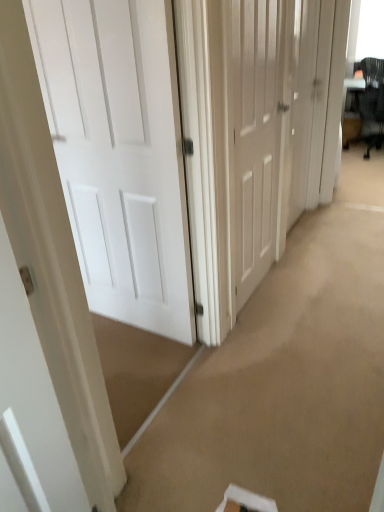
The width and height of the screenshot is (384, 512). Describe the element at coordinates (302, 102) in the screenshot. I see `white matte door at center, which ranks as the 3th door in left-to-right order` at that location.

How much space does white matte door at center, which ranks as the 2th door in right-to-left order, occupy horizontally?

white matte door at center, which ranks as the 2th door in right-to-left order, is 3.98 inches in width.

The image size is (384, 512). Find the location of `white matte door at center, the first door when ordered from left to right`. white matte door at center, the first door when ordered from left to right is located at coordinates (118, 154).

I want to click on black mesh swivel chair at upper right, so click(x=372, y=97).

Which object is wider, white matte door at center, positioned as the third door in right-to-left order, or black mesh swivel chair at upper right?

black mesh swivel chair at upper right.

How many degrees apart are the facing directions of white matte door at center, the first door when ordered from left to right, and black mesh swivel chair at upper right?

white matte door at center, the first door when ordered from left to right, and black mesh swivel chair at upper right are facing 90.8 degrees away from each other.

Is point (54, 133) positioned before point (368, 77)?

Yes.

Choose the correct answer: Is white matte door at center, the first door when ordered from left to right, inside black mesh swivel chair at upper right or outside it?

white matte door at center, the first door when ordered from left to right, is outside black mesh swivel chair at upper right.

Is white matte door at center, the first door positioned from the right, oriented towards black mesh swivel chair at upper right?

No, white matte door at center, the first door positioned from the right, does not turn towards black mesh swivel chair at upper right.

From a real-world perspective, does white matte door at center, which ranks as the 3th door in left-to-right order, sit lower than black mesh swivel chair at upper right?

No, from a real-world perspective, white matte door at center, which ranks as the 3th door in left-to-right order, is not under black mesh swivel chair at upper right.

Is white matte door at center, which ranks as the 3th door in left-to-right order, positioned behind black mesh swivel chair at upper right?

That is False.

Locate an element on the screen. The image size is (384, 512). swivel chair above the white matte door at center, the first door positioned from the right (from the image's perspective) is located at coordinates (372, 97).

Considering the positions of objects white matte door at center, which ranks as the 2th door in right-to-left order, and white matte door at center, positioned as the third door in right-to-left order, in the image provided, who is in front, white matte door at center, which ranks as the 2th door in right-to-left order, or white matte door at center, positioned as the third door in right-to-left order,?

white matte door at center, positioned as the third door in right-to-left order, is closer to the camera.

Who is taller, white matte door at center, which ranks as the 2th door in right-to-left order, or white matte door at center, positioned as the third door in right-to-left order?

white matte door at center, positioned as the third door in right-to-left order.

Is white matte door at center, which ranks as the 2th door in right-to-left order, to the left of white matte door at center, positioned as the third door in right-to-left order, from the viewer's perspective?

No.

From the image's perspective, would you say white matte door at center, which ranks as the 2th door in right-to-left order, is positioned over white matte door at center, the first door when ordered from left to right?

Indeed, from the image's perspective, white matte door at center, which ranks as the 2th door in right-to-left order, is shown above white matte door at center, the first door when ordered from left to right.

Could you tell me if black mesh swivel chair at upper right is facing white matte door at center, which ranks as the 3th door in left-to-right order?

Answer: No, black mesh swivel chair at upper right is not aimed at white matte door at center, which ranks as the 3th door in left-to-right order.

Can you confirm if black mesh swivel chair at upper right is shorter than white matte door at center, the first door positioned from the right?

Indeed, black mesh swivel chair at upper right has a lesser height compared to white matte door at center, the first door positioned from the right.

Based on the photo, how different are the orientations of black mesh swivel chair at upper right and white matte door at center, which ranks as the 3th door in left-to-right order, in degrees?

The angular difference between black mesh swivel chair at upper right and white matte door at center, which ranks as the 3th door in left-to-right order, is 90.3 degrees.

Is the depth of white matte door at center, the second door when ordered from left to right, greater than that of white matte door at center, which ranks as the 3th door in left-to-right order?

That is False.

Which is in front, point (270, 184) or point (310, 38)?

The point (270, 184) is closer to the camera.

Which object is wider, white matte door at center, the second door when ordered from left to right, or white matte door at center, which ranks as the 3th door in left-to-right order?

white matte door at center, the second door when ordered from left to right, is wider.

At what (x,y) coordinates should I click in order to perform the action: click on door located above the white matte door at center, which ranks as the 2th door in right-to-left order (from a real-world perspective). Please return your answer as a coordinate pair (x, y). Looking at the image, I should click on (302, 102).

In the scene shown: In terms of height, does black mesh swivel chair at upper right look taller or shorter compared to white matte door at center, positioned as the third door in right-to-left order?

In the image, black mesh swivel chair at upper right appears to be shorter than white matte door at center, positioned as the third door in right-to-left order.

From the image's perspective, which door is the 3rd one below the black mesh swivel chair at upper right? Please provide its 2D coordinates.

[(118, 154)]

Considering the positions of objects black mesh swivel chair at upper right and white matte door at center, the first door when ordered from left to right, in the image provided, who is more to the left, black mesh swivel chair at upper right or white matte door at center, the first door when ordered from left to right,?

white matte door at center, the first door when ordered from left to right, is more to the left.

In the scene shown: In terms of width, does black mesh swivel chair at upper right look wider or thinner when compared to white matte door at center, the first door when ordered from left to right?

Considering their sizes, black mesh swivel chair at upper right looks broader than white matte door at center, the first door when ordered from left to right.

You are a GUI agent. You are given a task and a screenshot of the screen. Output one action in this format:
    pyautogui.click(x=<x>, y=<y>)
    Task: Click on the swivel chair below the white matte door at center, the second door when ordered from left to right (from a real-world perspective)
    The image size is (384, 512).
    Given the screenshot: What is the action you would take?
    pyautogui.click(x=372, y=97)

Can you confirm if black mesh swivel chair at upper right is taller than white matte door at center, which ranks as the 2th door in right-to-left order?

No.

Is black mesh swivel chair at upper right at the left side of white matte door at center, the second door when ordered from left to right?

No.

Which of these two, black mesh swivel chair at upper right or white matte door at center, the second door when ordered from left to right, is wider?

black mesh swivel chair at upper right is wider.

I want to click on swivel chair on the right of white matte door at center, positioned as the third door in right-to-left order, so click(x=372, y=97).

Image resolution: width=384 pixels, height=512 pixels. In order to click on swivel chair directly beneath the white matte door at center, the first door positioned from the right (from a real-world perspective) in this screenshot , I will do `click(372, 97)`.

Estimate the real-world distances between objects in this image. Which object is closer to white matte door at center, the second door when ordered from left to right, white matte door at center, the first door when ordered from left to right, or black mesh swivel chair at upper right?

The object closer to white matte door at center, the second door when ordered from left to right, is white matte door at center, the first door when ordered from left to right.

Looking at the image, which one is located further to white matte door at center, which ranks as the 2th door in right-to-left order, white matte door at center, which ranks as the 3th door in left-to-right order, or black mesh swivel chair at upper right?

black mesh swivel chair at upper right lies further to white matte door at center, which ranks as the 2th door in right-to-left order, than the other object.

Considering their positions, is white matte door at center, which ranks as the 3th door in left-to-right order, positioned closer to black mesh swivel chair at upper right than white matte door at center, which ranks as the 2th door in right-to-left order?

white matte door at center, which ranks as the 3th door in left-to-right order, lies closer to black mesh swivel chair at upper right than the other object.

Which object lies nearer to the anchor point white matte door at center, the second door when ordered from left to right, black mesh swivel chair at upper right or white matte door at center, positioned as the third door in right-to-left order?

white matte door at center, positioned as the third door in right-to-left order, is closer to white matte door at center, the second door when ordered from left to right.

When comparing their distances from white matte door at center, the first door when ordered from left to right, does white matte door at center, the second door when ordered from left to right, or white matte door at center, which ranks as the 3th door in left-to-right order, seem further?

white matte door at center, which ranks as the 3th door in left-to-right order, is further to white matte door at center, the first door when ordered from left to right.

In the scene shown: Considering their positions, is white matte door at center, the first door positioned from the right, positioned closer to white matte door at center, the second door when ordered from left to right, than white matte door at center, positioned as the third door in right-to-left order?

white matte door at center, the first door positioned from the right.

Which object lies further to the anchor point black mesh swivel chair at upper right, white matte door at center, the first door positioned from the right, or white matte door at center, the first door when ordered from left to right?

white matte door at center, the first door when ordered from left to right, lies further to black mesh swivel chair at upper right than the other object.

Looking at this image, from the image, which object appears to be farther from white matte door at center, positioned as the third door in right-to-left order, white matte door at center, the first door positioned from the right, or white matte door at center, the second door when ordered from left to right?

white matte door at center, the first door positioned from the right.

Image resolution: width=384 pixels, height=512 pixels. Identify the location of door between white matte door at center, which ranks as the 2th door in right-to-left order, and black mesh swivel chair at upper right, along the z-axis. (302, 102).

The width and height of the screenshot is (384, 512). Find the location of `door between white matte door at center, positioned as the third door in right-to-left order, and white matte door at center, the first door positioned from the right, along the z-axis`. door between white matte door at center, positioned as the third door in right-to-left order, and white matte door at center, the first door positioned from the right, along the z-axis is located at coordinates (257, 135).